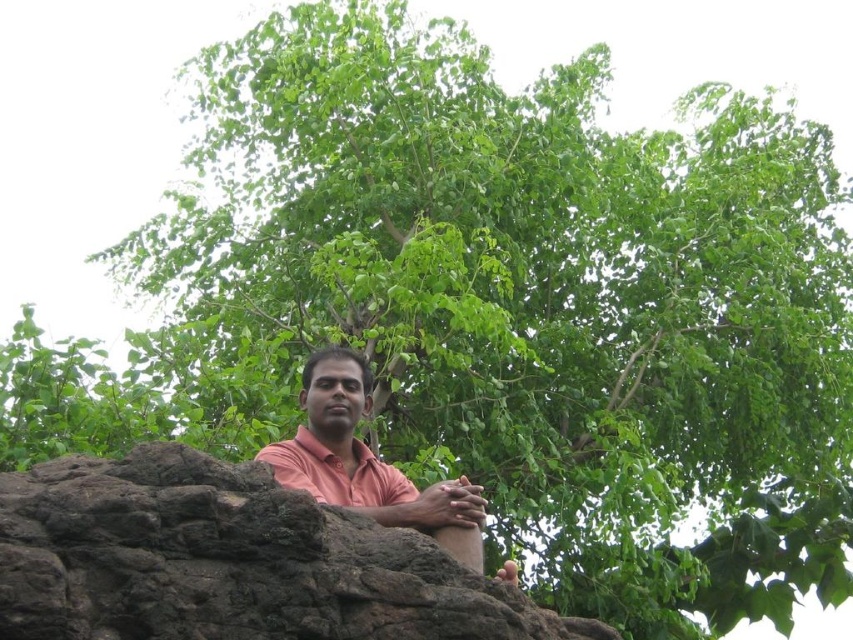
Question: Is brown rough rock at center closer to camera compared to pink matte shirt at center?

Choices:
 (A) yes
 (B) no

Answer: (A)

Question: Which point is closer to the camera taking this photo?

Choices:
 (A) (402, 490)
 (B) (291, 620)

Answer: (B)

Question: Does brown rough rock at center have a lesser width compared to pink matte shirt at center?

Choices:
 (A) no
 (B) yes

Answer: (A)

Question: Among these points, which one is farthest from the camera?

Choices:
 (A) (323, 534)
 (B) (347, 506)

Answer: (B)

Question: Can you confirm if brown rough rock at center is positioned below pink matte shirt at center?

Choices:
 (A) yes
 (B) no

Answer: (A)